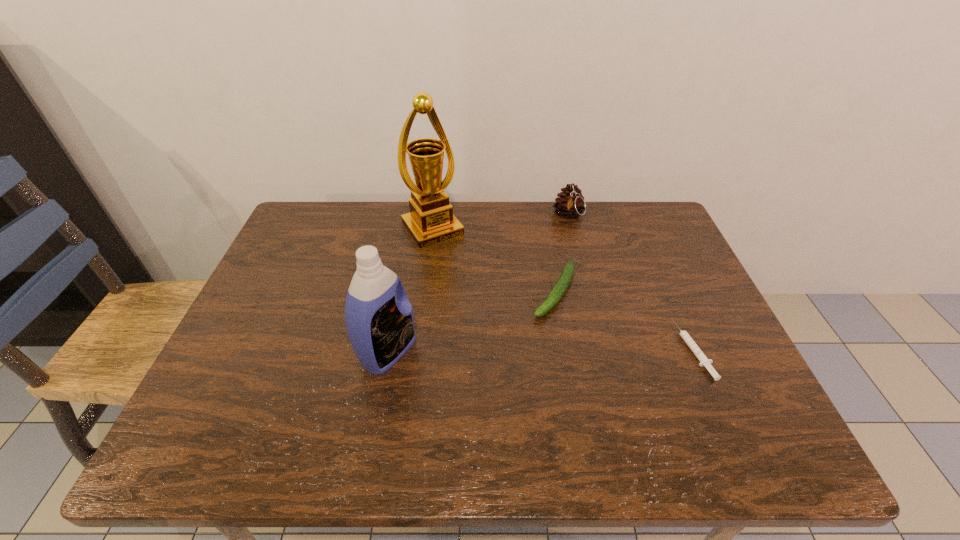
Select which object appears as the third closest to the zucchini. Please provide its 2D coordinates. Your answer should be formatted as a tuple, i.e. [(x, y)], where the tuple contains the x and y coordinates of a point satisfying the conditions above.

[(704, 361)]

Locate which object is the second closest to the award. Please provide its 2D coordinates. Your answer should be formatted as a tuple, i.e. [(x, y)], where the tuple contains the x and y coordinates of a point satisfying the conditions above.

[(569, 203)]

Find the location of `free spot that satisfies the following two spatial constraints: 1. on the back side of the fourth tallest object; 2. on the left side of the detergent`. free spot that satisfies the following two spatial constraints: 1. on the back side of the fourth tallest object; 2. on the left side of the detergent is located at coordinates (399, 291).

Locate an element on the screen. The height and width of the screenshot is (540, 960). vacant space that satisfies the following two spatial constraints: 1. on the front side of the syringe; 2. on the left side of the tallest object is located at coordinates (418, 349).